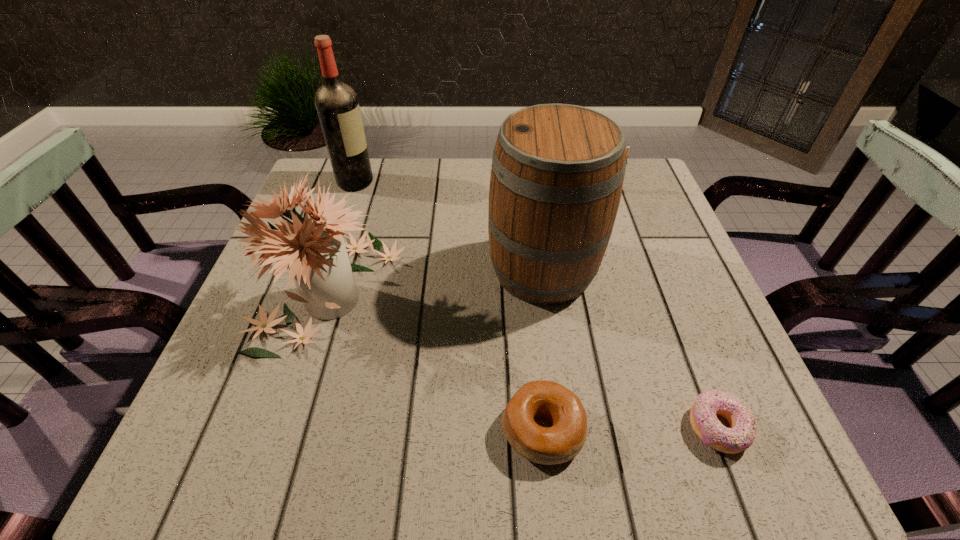
Find the location of a particular element. Image resolution: width=960 pixels, height=540 pixels. free point between the cider and the shortest object is located at coordinates (630, 349).

Identify the location of free point between the liquor and the fifth tallest object. (449, 306).

Locate an element on the screen. This screenshot has height=540, width=960. free space that is in between the bouquet and the second shortest object is located at coordinates (437, 359).

Image resolution: width=960 pixels, height=540 pixels. Find the location of `vacant space that is in between the fifth tallest object and the shortest object`. vacant space that is in between the fifth tallest object and the shortest object is located at coordinates (630, 429).

This screenshot has width=960, height=540. Identify the location of vacant space in between the bouquet and the cider. (437, 279).

Identify the location of free space between the liquor and the cider. (449, 226).

You are a GUI agent. You are given a task and a screenshot of the screen. Output one action in this format:
    pyautogui.click(x=<x>, y=<y>)
    Task: Click on the free space between the fourth tallest object and the doughnut
    The width and height of the screenshot is (960, 540).
    Given the screenshot: What is the action you would take?
    pyautogui.click(x=658, y=308)

Image resolution: width=960 pixels, height=540 pixels. I want to click on object that is the closest one to the shortest object, so click(x=560, y=443).

The image size is (960, 540). Find the location of `object that is the fifth closest to the liquor`. object that is the fifth closest to the liquor is located at coordinates (742, 432).

Find the location of a particular element. This screenshot has height=540, width=960. vacant space that satisfies the following two spatial constraints: 1. on the back side of the fourth tallest object; 2. on the front-facing side of the liquor is located at coordinates (596, 182).